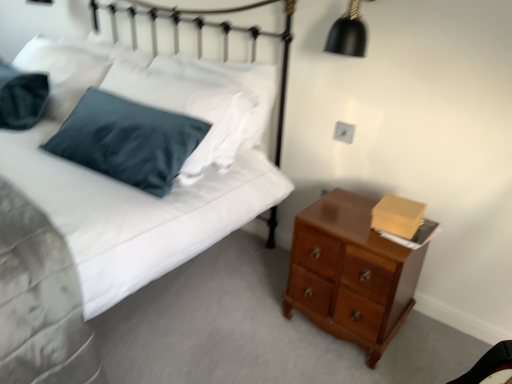
Question: Should I look upward or downward to see satin blue pillow at upper left?

Choices:
 (A) down
 (B) up

Answer: (B)

Question: Is black matte lampshade at upper right outside of satin blue pillow at upper left?

Choices:
 (A) no
 (B) yes

Answer: (B)

Question: Is black matte lampshade at upper right facing away from satin blue pillow at upper left?

Choices:
 (A) yes
 (B) no

Answer: (B)

Question: From the image's perspective, is black matte lampshade at upper right above satin blue pillow at upper left?

Choices:
 (A) no
 (B) yes

Answer: (B)

Question: Is black matte lampshade at upper right closer to the viewer compared to satin blue pillow at upper left?

Choices:
 (A) yes
 (B) no

Answer: (A)

Question: Does black matte lampshade at upper right come behind satin blue pillow at upper left?

Choices:
 (A) no
 (B) yes

Answer: (A)

Question: Is black matte lampshade at upper right wider than satin blue pillow at upper left?

Choices:
 (A) yes
 (B) no

Answer: (B)

Question: Could you tell me if black matte lampshade at upper right is turned towards glossy wood chest of drawers at lower right?

Choices:
 (A) yes
 (B) no

Answer: (B)

Question: Considering the relative sizes of black matte lampshade at upper right and glossy wood chest of drawers at lower right in the image provided, is black matte lampshade at upper right bigger than glossy wood chest of drawers at lower right?

Choices:
 (A) no
 (B) yes

Answer: (A)

Question: Considering the relative sizes of black matte lampshade at upper right and glossy wood chest of drawers at lower right in the image provided, is black matte lampshade at upper right shorter than glossy wood chest of drawers at lower right?

Choices:
 (A) yes
 (B) no

Answer: (A)

Question: Does black matte lampshade at upper right have a lesser width compared to glossy wood chest of drawers at lower right?

Choices:
 (A) yes
 (B) no

Answer: (A)

Question: Does black matte lampshade at upper right appear on the right side of glossy wood chest of drawers at lower right?

Choices:
 (A) yes
 (B) no

Answer: (B)

Question: Considering the relative sizes of black matte lampshade at upper right and glossy wood chest of drawers at lower right in the image provided, is black matte lampshade at upper right taller than glossy wood chest of drawers at lower right?

Choices:
 (A) no
 (B) yes

Answer: (A)

Question: Is glossy wood chest of drawers at lower right directly adjacent to black matte lampshade at upper right?

Choices:
 (A) yes
 (B) no

Answer: (B)